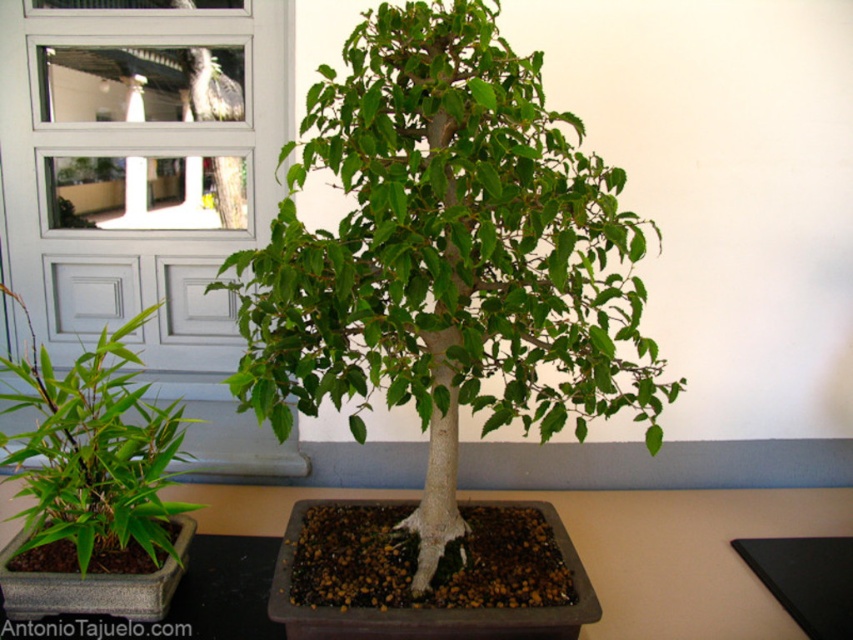
Where is `green matte bonsai tree at center`? green matte bonsai tree at center is located at coordinates (445, 256).

Is point (438, 355) less distant than point (630, 509)?

Yes, point (438, 355) is in front of point (630, 509).

Is point (322, 358) closer to viewer compared to point (743, 496)?

Yes, point (322, 358) is in front of point (743, 496).

At what (x,y) coordinates should I click in order to perform the action: click on green matte bonsai tree at center. Please return your answer as a coordinate pair (x, y). Looking at the image, I should click on 445,256.